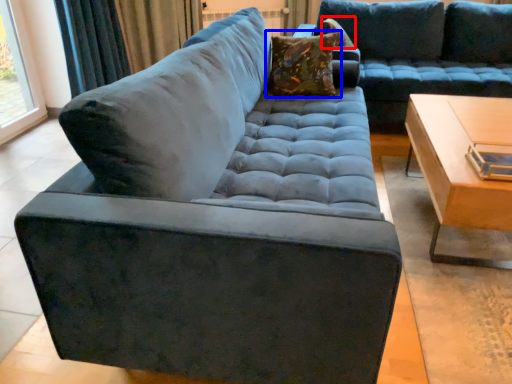
Question: Which point is closer to the camera, pillow (highlighted by a red box) or pillow (highlighted by a blue box)?

Choices:
 (A) pillow
 (B) pillow

Answer: (B)